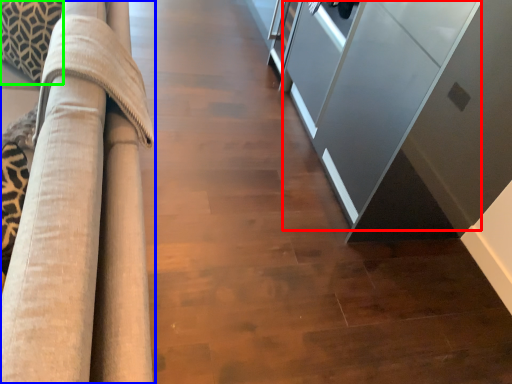
Question: Considering the real-world distances, which object is farthest from glass door (highlighted by a red box)? furniture (highlighted by a blue box) or pillow (highlighted by a green box)?

Choices:
 (A) furniture
 (B) pillow

Answer: (B)